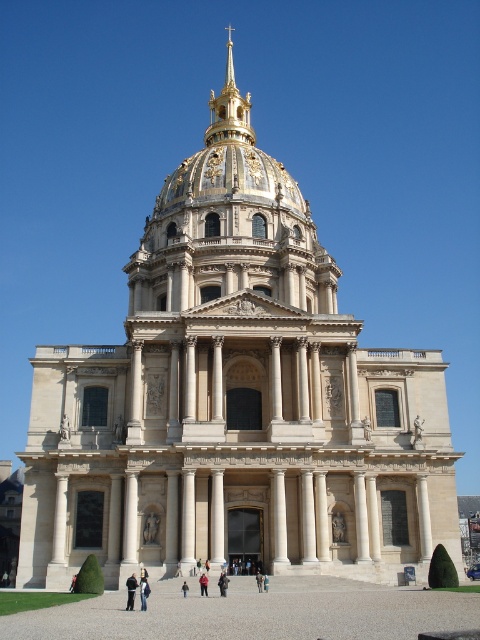
Question: Does dark blue jeans at center lie behind dark brown leather jacket at center?

Choices:
 (A) yes
 (B) no

Answer: (B)

Question: Which object is farther from the camera taking this photo?

Choices:
 (A) dark blue jeans at center
 (B) red fabric person at center
 (C) brown leather jacket at center
 (D) gold/gilded metal spire at upper center

Answer: (D)

Question: Does light brown leather jacket at center appear under red fabric person at center?

Choices:
 (A) yes
 (B) no

Answer: (B)

Question: Can you confirm if light brown leather jacket at center is bigger than brown leather jacket at center?

Choices:
 (A) no
 (B) yes

Answer: (B)

Question: Which point is farther from the camera taking this photo?

Choices:
 (A) (205, 592)
 (B) (186, 588)
 (C) (226, 579)
 (D) (229, 45)

Answer: (D)

Question: Estimate the real-world distances between objects in this image. Which object is closer to the dark brown leather jacket at center?

Choices:
 (A) red fabric person at center
 (B) light brown leather jacket at center
 (C) brown leather jacket at center
 (D) dark blue jeans at center

Answer: (A)